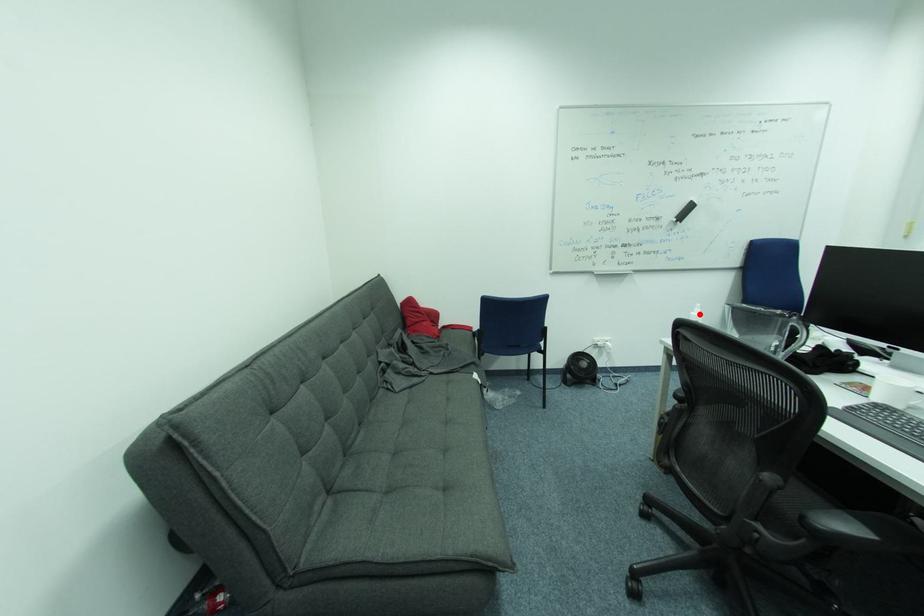
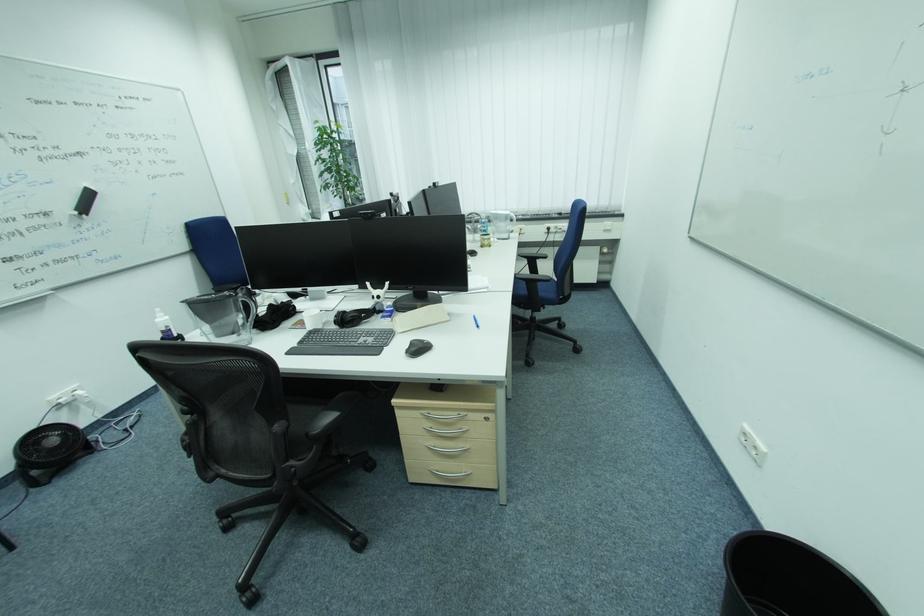
Where in the second image is the point corresponding to the highlighted location from the first image?

(164, 321)